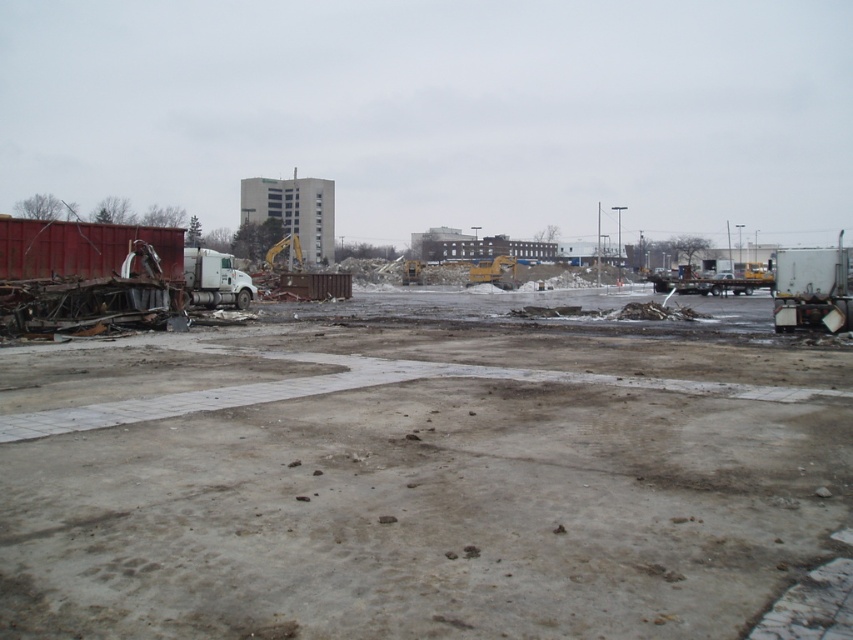
You are a delivery driver who needs to park your truck in the construction site. You see the rusty metal debris at left and the white matte trailer truck at right. Where should you park your truck to avoid the debris?

You should park your truck at the right side near the white matte trailer truck at right because the rusty metal debris at left is located below it, meaning the area near the white matte trailer truck at right is clear of debris.

You are a delivery driver who needs to park your truck near the construction site. You see the rusty metal debris at left and the white matte trailer truck at right. Which area would you avoid parking in to ensure safety?

You should avoid parking near the rusty metal debris at left because it is smaller and might be unstable compared to the white matte trailer truck at right, which is larger and more securely positioned.

You are a construction worker standing at the center of the site. You need to place a new equipment at the coordinates given in the description. Where should you place the new equipment relative to the rusty metal debris at left?

Result: The rusty metal debris at left is located at coordinates point [422,472]. Since the worker is at the center, the new equipment should be placed to the right of the rusty metal debris at left, as the x coordinate 0.739 is to the right of the center point.